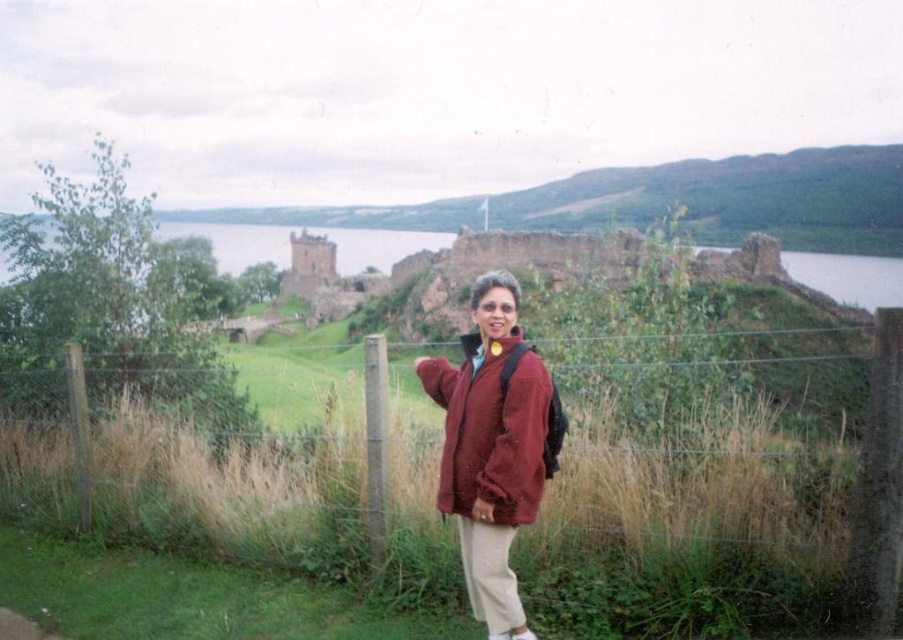
Question: Is wire mesh fence at center smaller than matte red jacket at center?

Choices:
 (A) no
 (B) yes

Answer: (A)

Question: Is matte red jacket at center below stone brick castle at center?

Choices:
 (A) yes
 (B) no

Answer: (A)

Question: Where is matte red jacket at center located in relation to stone brick castle at center in the image?

Choices:
 (A) below
 (B) above

Answer: (A)

Question: Among these points, which one is farthest from the camera?

Choices:
 (A) (296, 236)
 (B) (499, 465)
 (C) (503, 524)

Answer: (A)

Question: Estimate the real-world distances between objects in this image. Which object is farther from the matte red jacket at center?

Choices:
 (A) stone brick castle at center
 (B) wire mesh fence at center

Answer: (A)

Question: Which object appears farthest from the camera in this image?

Choices:
 (A) matte red jacket at center
 (B) stone brick castle at center
 (C) wire mesh fence at center

Answer: (B)